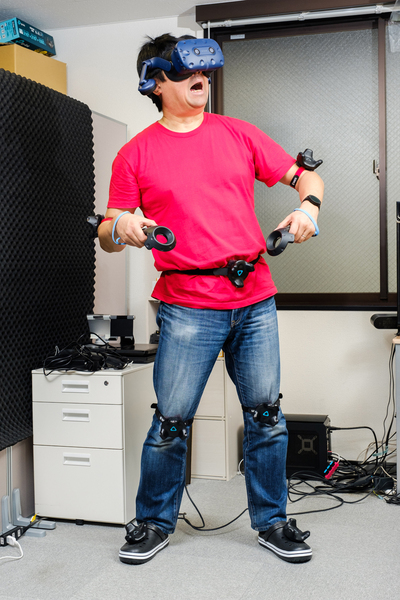
Identify the location of cardboard box on top of shelf. This screenshot has height=600, width=400. (31, 67).